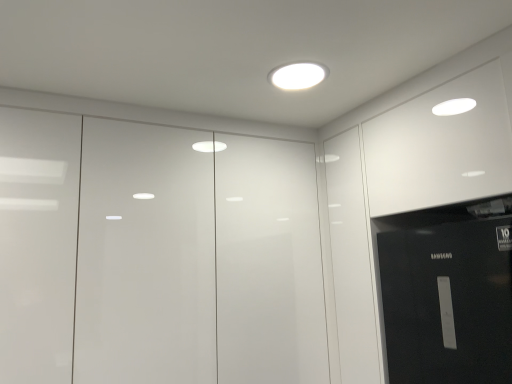
At what (x,y) coordinates should I click in order to perform the action: click on glossy white screen door at upper center. Please return your answer as a coordinate pair (x, y). This screenshot has height=384, width=512. Looking at the image, I should click on (197, 259).

Describe the element at coordinates (197, 259) in the screenshot. Image resolution: width=512 pixels, height=384 pixels. I see `glossy white screen door at upper center` at that location.

This screenshot has height=384, width=512. I want to click on glossy white screen door at upper center, so click(x=197, y=259).